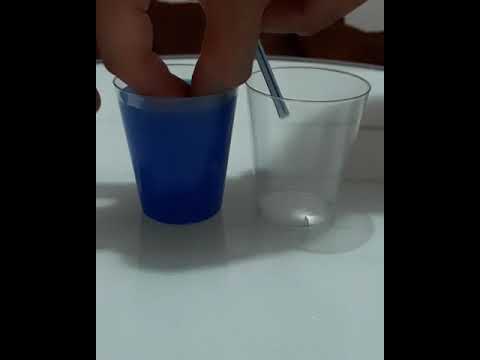
At what (x,y) coordinates should I click in order to perform the action: click on rim area of empty glass. Please return your answer as a coordinate pair (x, y). The image size is (480, 360). Looking at the image, I should click on (325, 100), (320, 65).